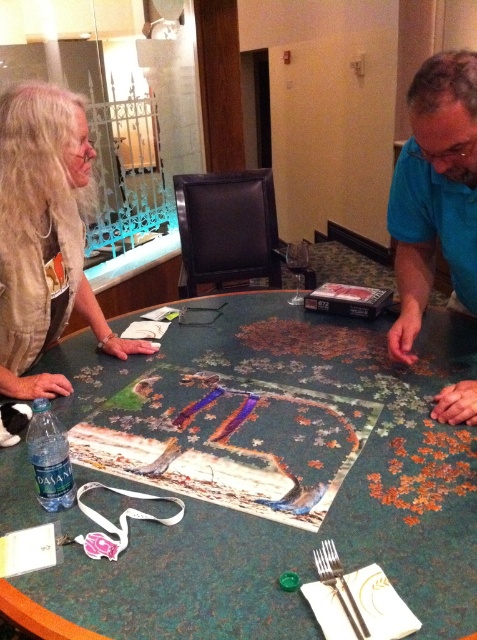
Question: Estimate the real-world distances between objects in this image. Which object is farther from the long blonde hair at upper left?

Choices:
 (A) green marble table at center
 (B) blue matte shirt at upper right
 (C) silver metallic fork at lower center

Answer: (C)

Question: Which point is closer to the camera?

Choices:
 (A) (34, 275)
 (B) (314, 548)
 (C) (84, 605)

Answer: (C)

Question: Observing the image, what is the correct spatial positioning of blue matte shirt at upper right in reference to silver metallic fork at lower center?

Choices:
 (A) left
 (B) right

Answer: (B)

Question: Estimate the real-world distances between objects in this image. Which object is closer to the silver metallic fork at lower center?

Choices:
 (A) blue matte shirt at upper right
 (B) green marble table at center

Answer: (B)

Question: Does green marble table at center come behind blue matte shirt at upper right?

Choices:
 (A) yes
 (B) no

Answer: (B)

Question: Is green marble table at center bigger than long blonde hair at upper left?

Choices:
 (A) no
 (B) yes

Answer: (B)